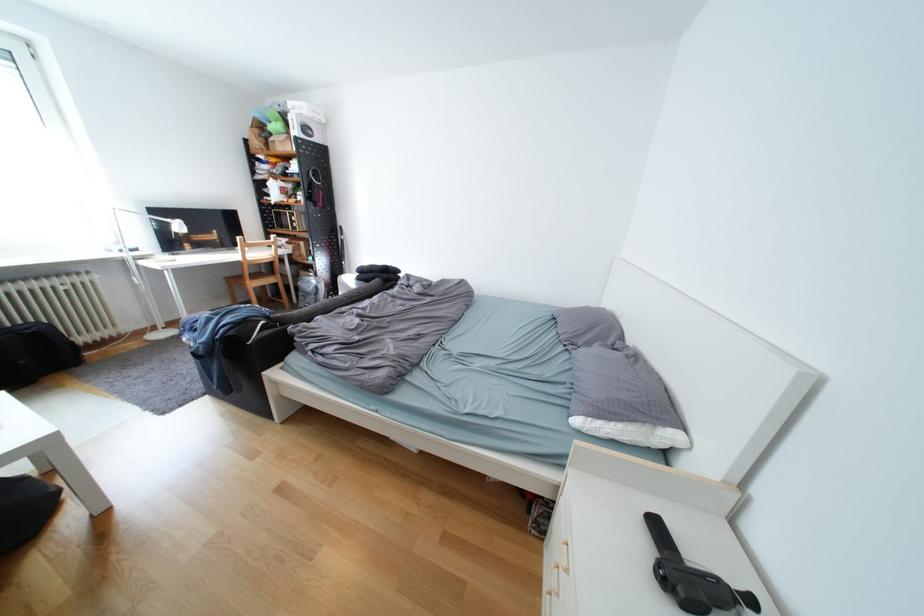
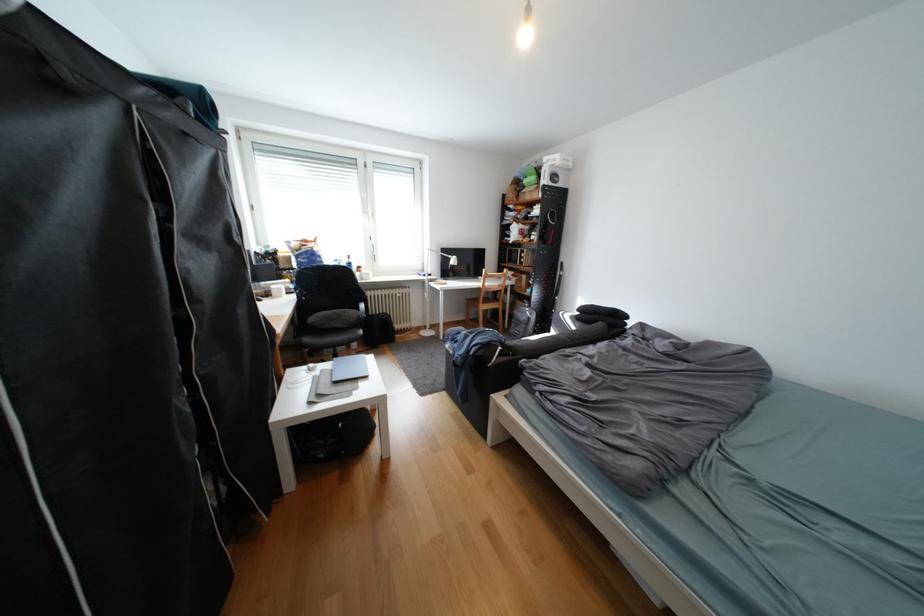
Question: The first image is from the beginning of the video and the second image is from the end. How did the camera likely rotate when shooting the video?

Choices:
 (A) Left
 (B) Right
 (C) Up
 (D) Down

Answer: (A)